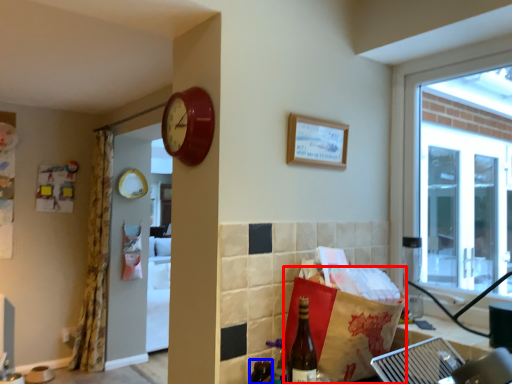
Question: Which point is further to the camera, shopping bag (highlighted by a red box) or bottle (highlighted by a blue box)?

Choices:
 (A) shopping bag
 (B) bottle

Answer: (B)